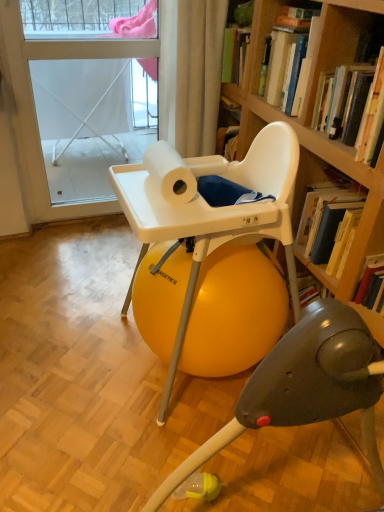
Where is `free space in front of white plastic highchair at center`? Image resolution: width=384 pixels, height=512 pixels. free space in front of white plastic highchair at center is located at coordinates (190, 452).